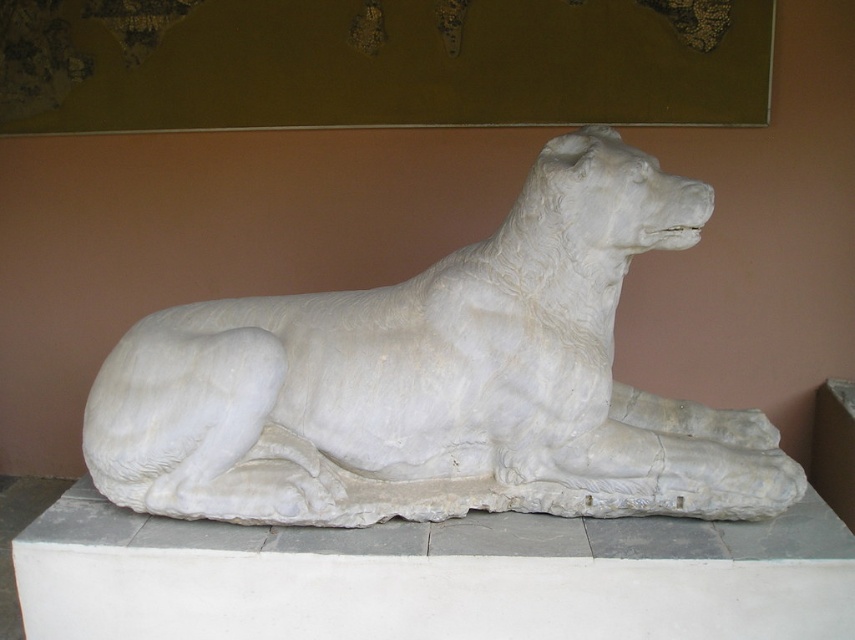
Does white marble lion at center appear under white marble dog at center?

Incorrect, white marble lion at center is not positioned below white marble dog at center.

Can you confirm if white marble lion at center is taller than white marble dog at center?

Correct, white marble lion at center is much taller as white marble dog at center.

I want to click on white marble lion at center, so [439, 381].